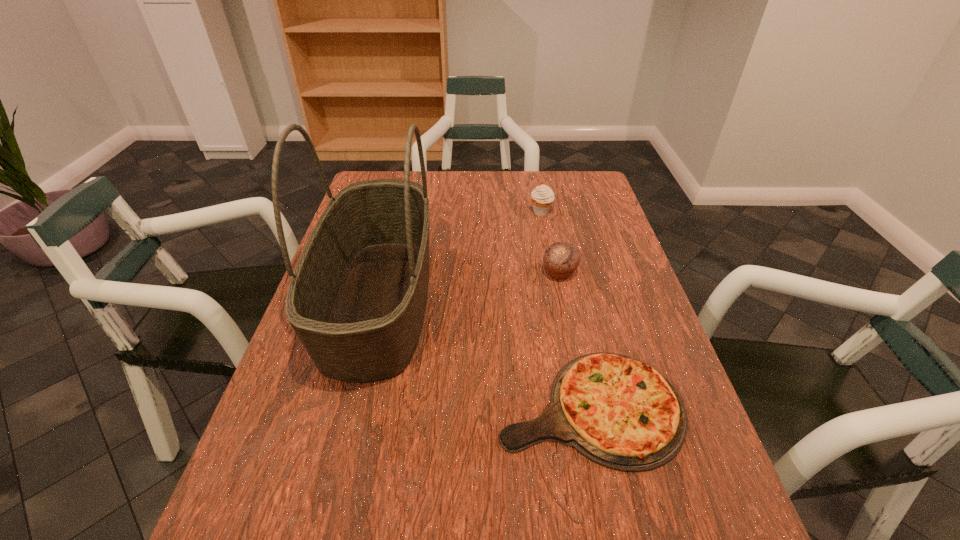
The width and height of the screenshot is (960, 540). In order to click on free space that satisfies the following two spatial constraints: 1. on the front side of the farther muffin; 2. on the right side of the shortest object in this screenshot , I will do `click(579, 407)`.

Locate an element on the screen. vacant position in the image that satisfies the following two spatial constraints: 1. on the front side of the pizza; 2. on the left side of the basket is located at coordinates (353, 407).